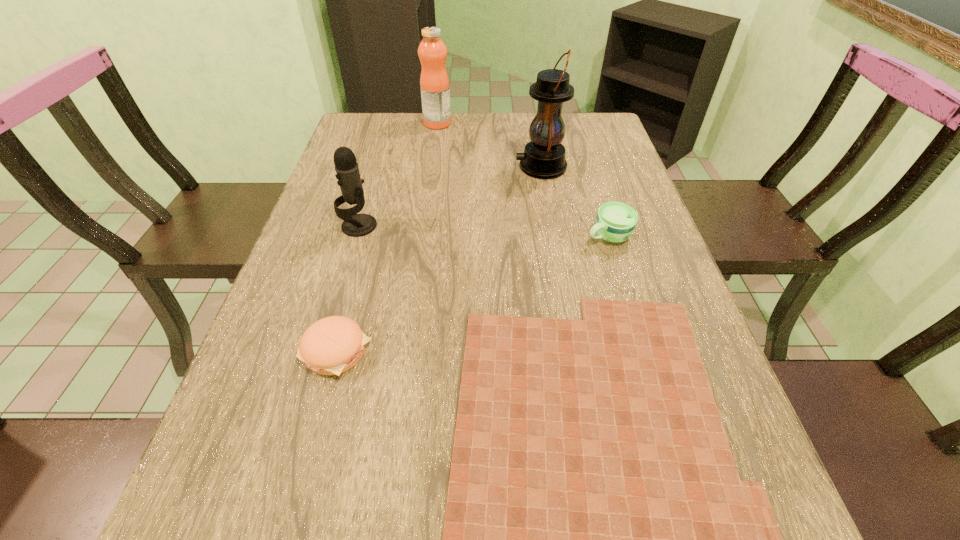
The width and height of the screenshot is (960, 540). I want to click on free space at the right edge of the desktop, so click(612, 159).

This screenshot has width=960, height=540. Find the location of `free region at the far left corner of the desktop`. free region at the far left corner of the desktop is located at coordinates (346, 143).

Image resolution: width=960 pixels, height=540 pixels. What are the coordinates of `vacant area at the far right corner` in the screenshot? It's located at (568, 113).

This screenshot has height=540, width=960. In order to click on free area in between the fourth shortest object and the patty in this screenshot , I will do `click(348, 288)`.

This screenshot has height=540, width=960. What are the coordinates of `vacant area that lies between the cup and the fifth tallest object` in the screenshot? It's located at (472, 294).

Where is `unoccupied area between the fourth shortest object and the fourth tallest object`? The image size is (960, 540). unoccupied area between the fourth shortest object and the fourth tallest object is located at coordinates (484, 231).

The width and height of the screenshot is (960, 540). I want to click on free space between the fifth nearest object and the fifth tallest object, so click(x=439, y=259).

The height and width of the screenshot is (540, 960). Identify the location of vacant space that's between the lantern and the microphone. (450, 196).

In order to click on free space between the third tallest object and the lantern in this screenshot , I will do `click(450, 196)`.

This screenshot has height=540, width=960. I want to click on vacant area that lies between the microphone and the patty, so click(x=348, y=288).